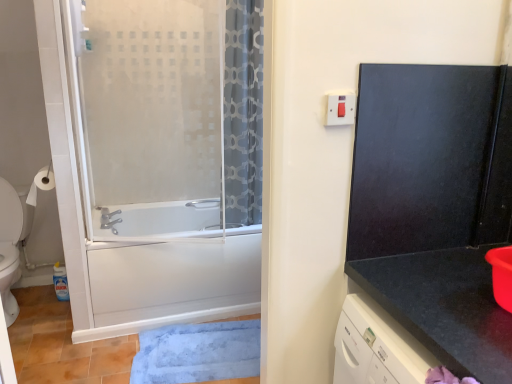
Where is `free spot in front of black matte screen door at upper right, acting as the second screen door starting from the left`? The height and width of the screenshot is (384, 512). free spot in front of black matte screen door at upper right, acting as the second screen door starting from the left is located at coordinates (443, 292).